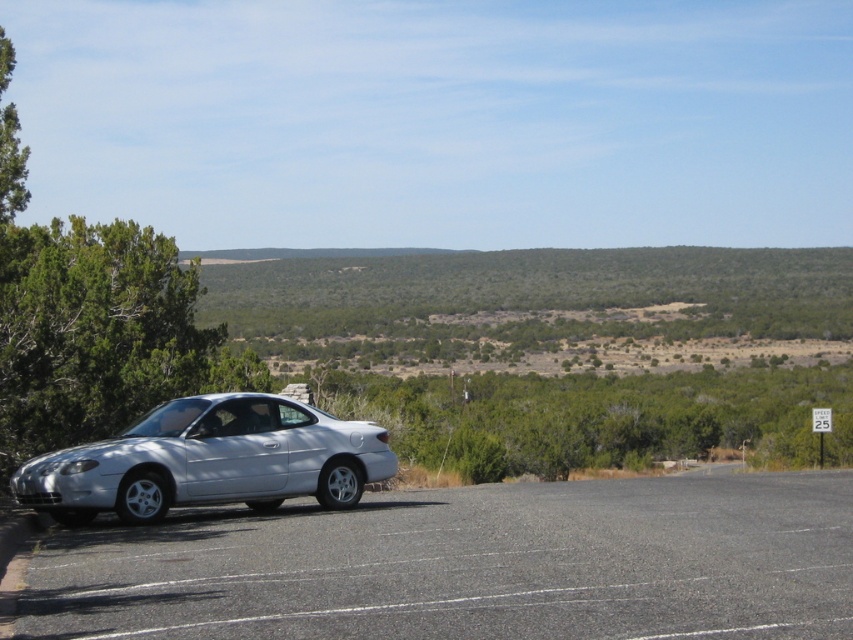
The width and height of the screenshot is (853, 640). What do you see at coordinates (469, 564) in the screenshot? I see `gray asphalt parking lot at lower left` at bounding box center [469, 564].

In order to click on gray asphalt parking lot at lower left in this screenshot , I will do `click(469, 564)`.

At what (x,y) coordinates should I click in order to perform the action: click on gray asphalt parking lot at lower left. Please return your answer as a coordinate pair (x, y). The image size is (853, 640). Looking at the image, I should click on [469, 564].